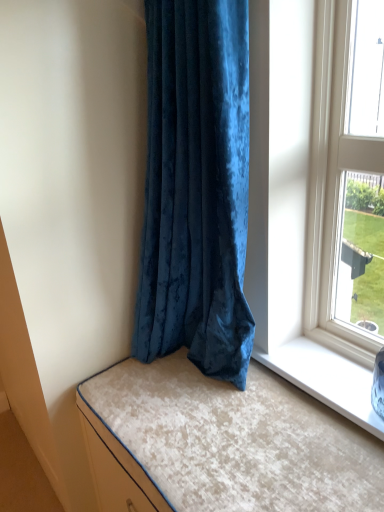
Identify the location of free space in front of velvet blue curtain at center. Image resolution: width=384 pixels, height=512 pixels. (220, 437).